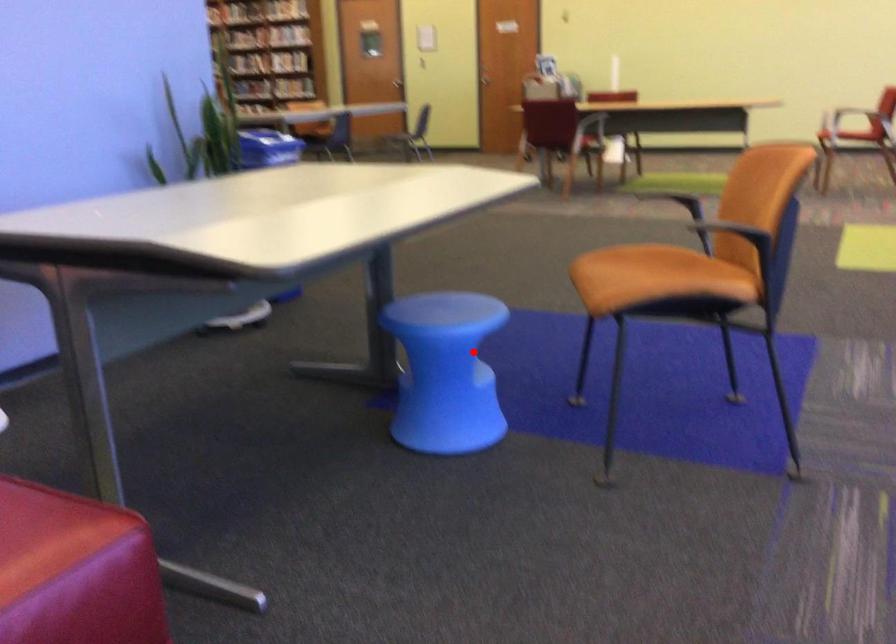
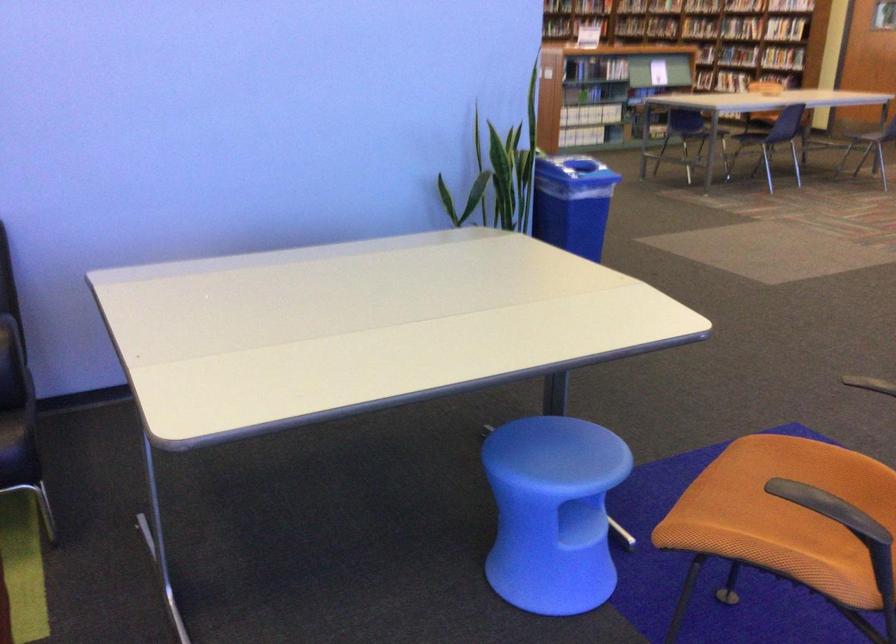
Question: I am providing you with two images of the same scene from different viewpoints. Given a red point in image1, look at the same physical point in image2. Is it:

Choices:
 (A) Closer to the viewpoint
 (B) Farther from the viewpoint

Answer: (A)